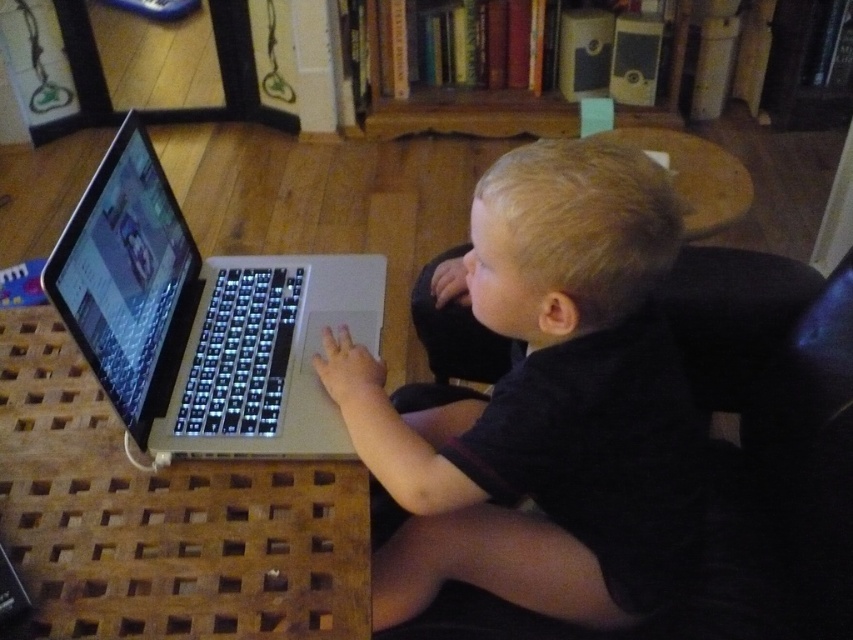
Is silver metallic laptop at lower left behind wooden bookshelf at upper center?

No, silver metallic laptop at lower left is closer to the viewer.

What do you see at coordinates (201, 321) in the screenshot? Image resolution: width=853 pixels, height=640 pixels. I see `silver metallic laptop at lower left` at bounding box center [201, 321].

I want to click on silver metallic laptop at lower left, so click(x=201, y=321).

Measure the distance between point (657, 470) and camera.

The distance of point (657, 470) from camera is 33.81 inches.

Between point (622, 403) and point (650, 124), which one is positioned behind?

The point (650, 124) is more distant.

Image resolution: width=853 pixels, height=640 pixels. Identify the location of black matte laptop at lower left. (544, 403).

Between silver metallic laptop at lower left and black fabric chair at right, which one has less height?

With less height is black fabric chair at right.

Can you confirm if silver metallic laptop at lower left is thinner than black fabric chair at right?

Correct, silver metallic laptop at lower left's width is less than black fabric chair at right's.

Is point (80, 298) in front of point (456, 348)?

Yes, it is in front of point (456, 348).

Find the location of a particular element. The image size is (853, 640). silver metallic laptop at lower left is located at coordinates (201, 321).